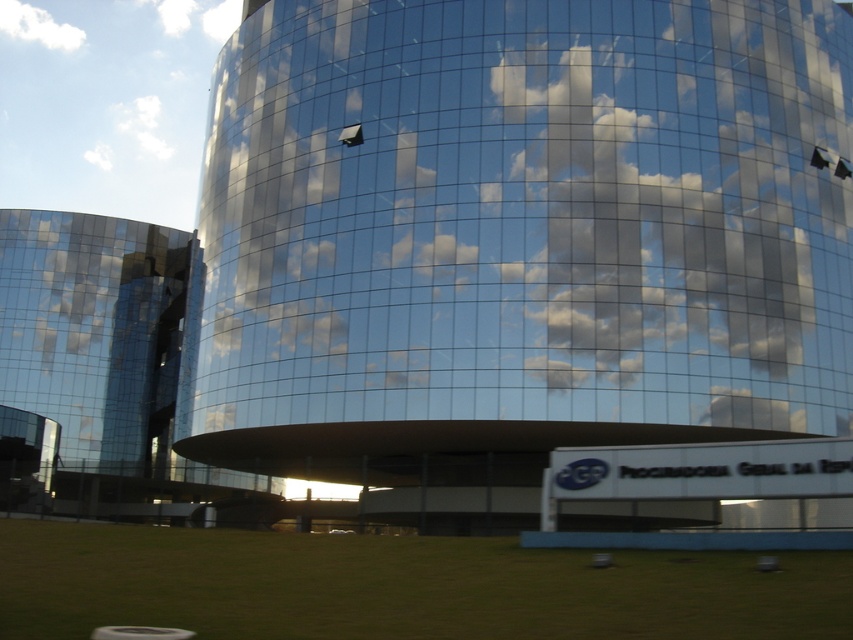
Between transparent glass cloud at center and white fluffy cloud at upper left, which one appears on the left side from the viewer's perspective?

white fluffy cloud at upper left

Can you confirm if transparent glass cloud at center is shorter than white fluffy cloud at upper left?

No, transparent glass cloud at center is not shorter than white fluffy cloud at upper left.

In order to click on transparent glass cloud at center in this screenshot , I will do (529, 214).

The height and width of the screenshot is (640, 853). I want to click on transparent glass cloud at center, so click(529, 214).